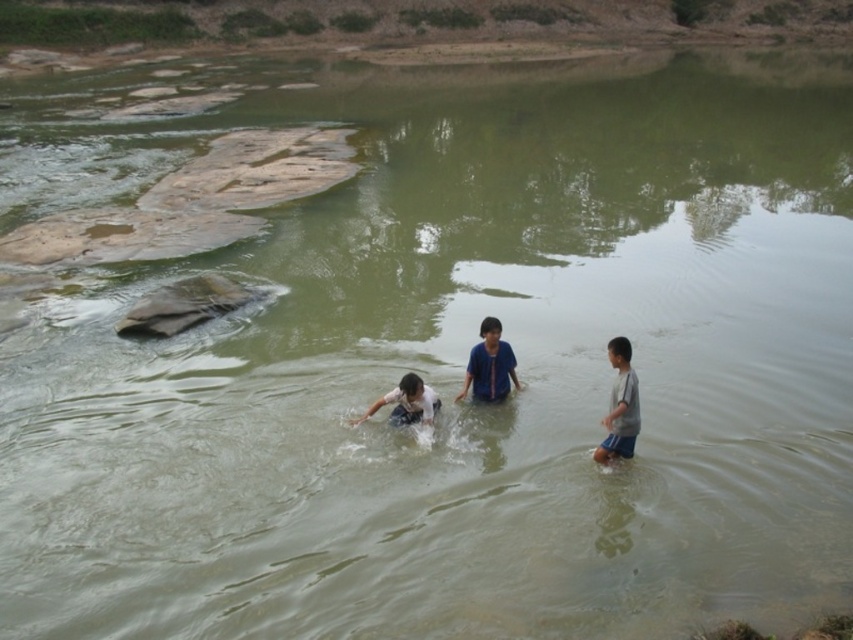
Which is below, gray rough rock at center-left or blue cotton shirt at center?

blue cotton shirt at center is below.

Can you confirm if gray rough rock at center-left is positioned to the left of blue cotton shirt at center?

Correct, you'll find gray rough rock at center-left to the left of blue cotton shirt at center.

What do you see at coordinates (183, 305) in the screenshot?
I see `gray rough rock at center-left` at bounding box center [183, 305].

The height and width of the screenshot is (640, 853). I want to click on gray rough rock at center-left, so click(183, 305).

Is gray rough rock at center-left in front of gray cotton shorts at lower right?

That is False.

Is gray rough rock at center-left wider than gray cotton shorts at lower right?

Correct, the width of gray rough rock at center-left exceeds that of gray cotton shorts at lower right.

Describe the element at coordinates (183, 305) in the screenshot. I see `gray rough rock at center-left` at that location.

Locate an element on the screen. The image size is (853, 640). gray rough rock at center-left is located at coordinates (183, 305).

Between point (625, 433) and point (421, 394), which one is positioned behind?

Positioned behind is point (421, 394).

Where is `gray cotton shorts at lower right`? The height and width of the screenshot is (640, 853). gray cotton shorts at lower right is located at coordinates click(619, 404).

Who is more forward, (610, 420) or (422, 403)?

Positioned in front is point (610, 420).

This screenshot has height=640, width=853. I want to click on gray cotton shorts at lower right, so click(619, 404).